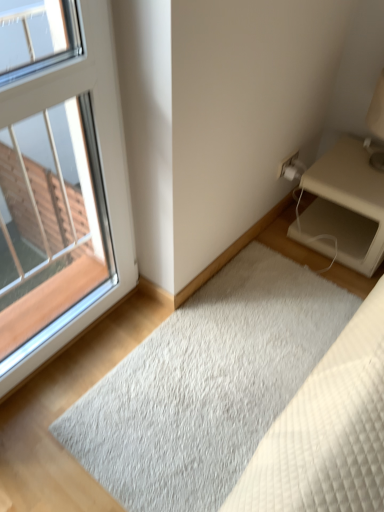
Question: From a real-world perspective, is white plastic window at upper left physically above beige matte nightstand at right?

Choices:
 (A) no
 (B) yes

Answer: (B)

Question: Does white plastic window at upper left have a smaller size compared to beige matte nightstand at right?

Choices:
 (A) no
 (B) yes

Answer: (A)

Question: From the image's perspective, is white plastic window at upper left beneath beige matte nightstand at right?

Choices:
 (A) yes
 (B) no

Answer: (A)

Question: Does white plastic window at upper left have a greater height compared to beige matte nightstand at right?

Choices:
 (A) yes
 (B) no

Answer: (A)

Question: From a real-world perspective, is white plastic window at upper left located beneath beige matte nightstand at right?

Choices:
 (A) no
 (B) yes

Answer: (A)

Question: From the image's perspective, is beige matte nightstand at right above or below white shaggy rug at lower center?

Choices:
 (A) below
 (B) above

Answer: (B)

Question: From a real-world perspective, is beige matte nightstand at right positioned above or below white shaggy rug at lower center?

Choices:
 (A) above
 (B) below

Answer: (A)

Question: Is beige matte nightstand at right bigger or smaller than white shaggy rug at lower center?

Choices:
 (A) big
 (B) small

Answer: (A)

Question: In the image, is beige matte nightstand at right on the left side or the right side of white shaggy rug at lower center?

Choices:
 (A) right
 (B) left

Answer: (A)

Question: Would you say white shaggy rug at lower center is inside or outside white plastic window at upper left?

Choices:
 (A) inside
 (B) outside

Answer: (B)

Question: In the image, is white shaggy rug at lower center positioned in front of or behind white plastic window at upper left?

Choices:
 (A) behind
 (B) front

Answer: (A)

Question: Considering the positions of white shaggy rug at lower center and white plastic window at upper left in the image, is white shaggy rug at lower center wider or thinner than white plastic window at upper left?

Choices:
 (A) thin
 (B) wide

Answer: (B)

Question: From their relative heights in the image, would you say white shaggy rug at lower center is taller or shorter than white plastic window at upper left?

Choices:
 (A) tall
 (B) short

Answer: (B)

Question: Choose the correct answer: Is white shaggy rug at lower center inside beige matte nightstand at right or outside it?

Choices:
 (A) inside
 (B) outside

Answer: (B)

Question: Considering the positions of white shaggy rug at lower center and beige matte nightstand at right in the image, is white shaggy rug at lower center taller or shorter than beige matte nightstand at right?

Choices:
 (A) short
 (B) tall

Answer: (A)